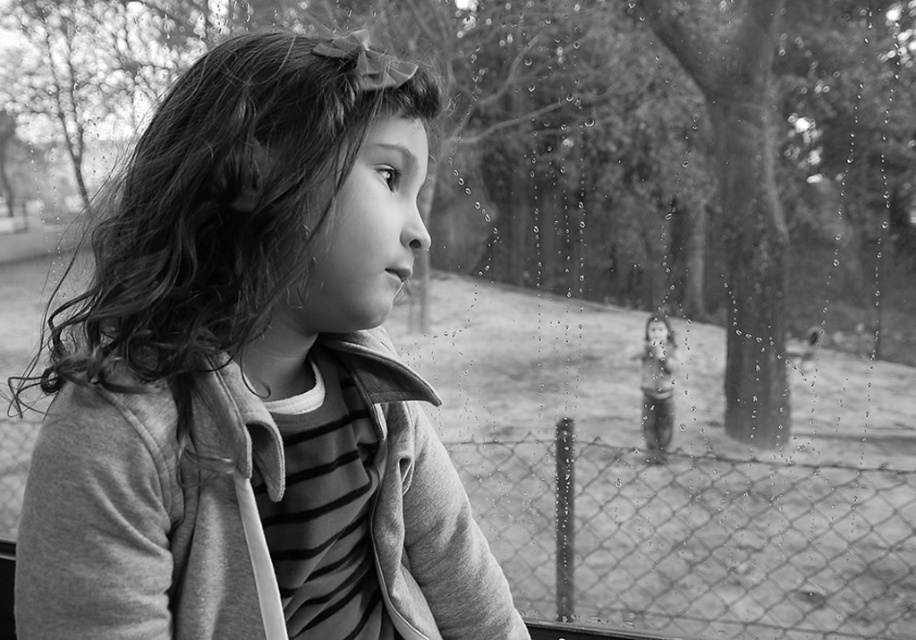
Who is higher up, soft fabric girl at left or wire mesh fence at lower center?

soft fabric girl at left is higher up.

Can you confirm if soft fabric girl at left is positioned to the right of wire mesh fence at lower center?

In fact, soft fabric girl at left is to the left of wire mesh fence at lower center.

What are the coordinates of `soft fabric girl at left` in the screenshot? It's located at (254, 378).